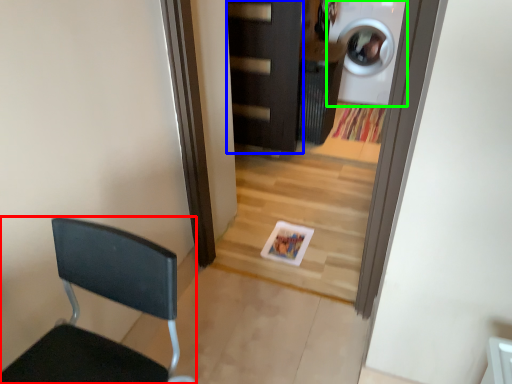
Question: Considering the real-world distances, which object is farthest from chair (highlighted by a red box)? door (highlighted by a blue box) or washing machine (highlighted by a green box)?

Choices:
 (A) door
 (B) washing machine

Answer: (B)